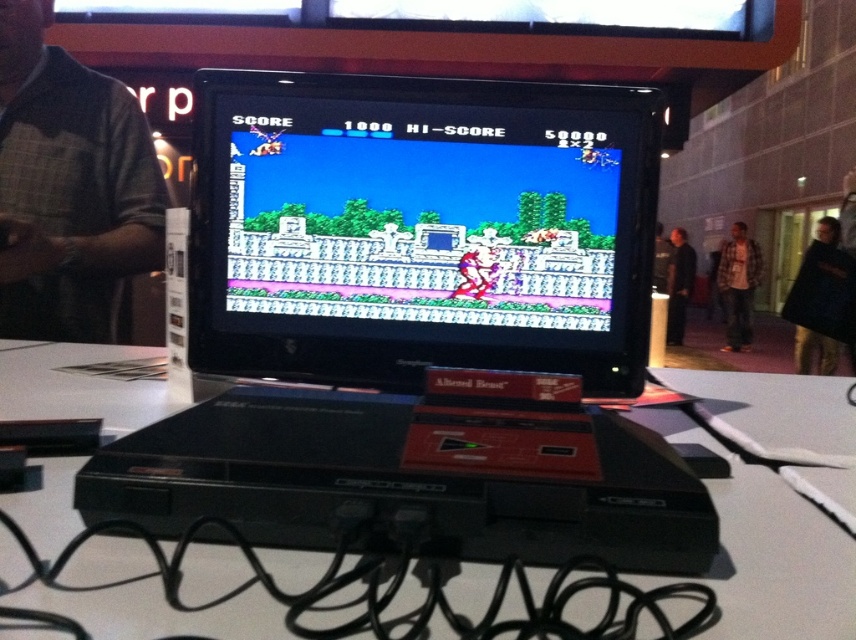
Does pixelated screen at center have a lesser width compared to plaid flannel shirt at center?

Indeed, pixelated screen at center has a lesser width compared to plaid flannel shirt at center.

Which is in front, point (563, 250) or point (735, 237)?

Point (563, 250) is more forward.

This screenshot has height=640, width=856. Find the location of `pixelated screen at center`. pixelated screen at center is located at coordinates click(x=421, y=211).

Does black plastic computer at center appear under black fabric at right?

Incorrect, black plastic computer at center is not positioned below black fabric at right.

Who is more distant from viewer, (x=207, y=205) or (x=834, y=224)?

Positioned behind is point (x=834, y=224).

Which is in front, point (643, 305) or point (815, 358)?

Positioned in front is point (643, 305).

Identify the location of black plastic computer at center. The image size is (856, 640). (417, 324).

Is white glossy table at center smaller than plaid flannel shirt at center?

Yes.

Which of these two, white glossy table at center or plaid flannel shirt at center, stands shorter?

white glossy table at center is shorter.

Who is more distant from viewer, (770, 483) or (740, 262)?

Positioned behind is point (740, 262).

Where is `white glossy table at center`? white glossy table at center is located at coordinates tap(789, 557).